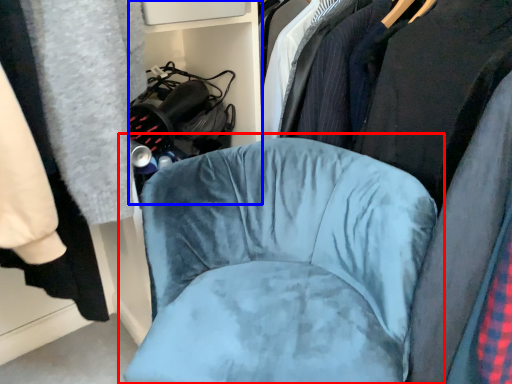
Question: Which point is closer to the camera, chair (highlighted by a red box) or bookshelf (highlighted by a blue box)?

Choices:
 (A) chair
 (B) bookshelf

Answer: (A)